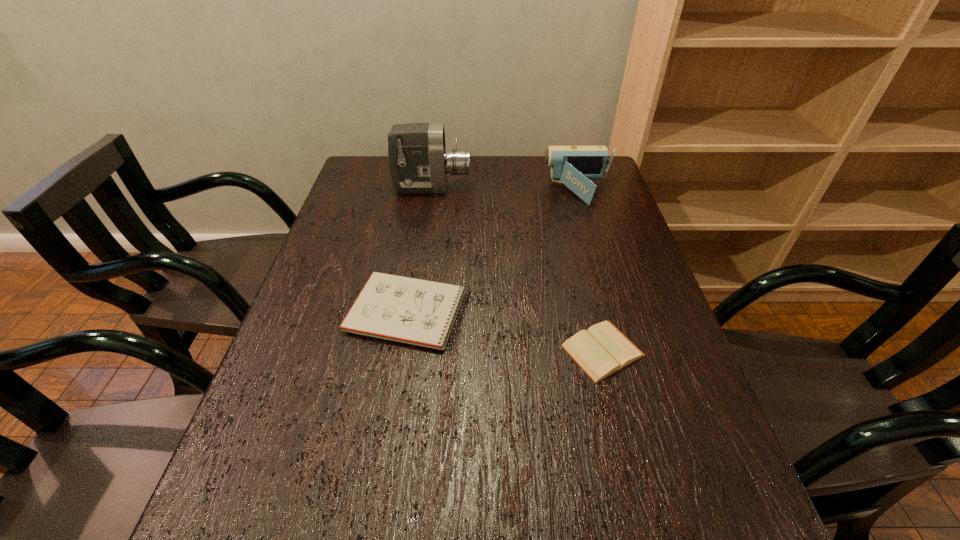
Locate an element on the screen. The image size is (960, 540). free region located on the right of the notepad is located at coordinates (524, 312).

Where is `free region located 0.390m on the back of the diary`? This screenshot has height=540, width=960. free region located 0.390m on the back of the diary is located at coordinates (569, 219).

Identify the location of camcorder located at the left edge. (418, 161).

This screenshot has height=540, width=960. I want to click on notepad at the left edge, so click(x=415, y=311).

I want to click on camcorder positioned at the right edge, so click(573, 166).

Locate an element on the screen. This screenshot has width=960, height=540. diary located in the right edge section of the desktop is located at coordinates (600, 351).

Image resolution: width=960 pixels, height=540 pixels. In order to click on object that is at the far left corner in this screenshot , I will do `click(418, 161)`.

The height and width of the screenshot is (540, 960). I want to click on object that is at the far right corner, so click(x=573, y=166).

Where is `vacant area at the far edge`? vacant area at the far edge is located at coordinates (494, 183).

You are a GUI agent. You are given a task and a screenshot of the screen. Output one action in this format:
    pyautogui.click(x=<x>, y=<y>)
    Task: Click on the vacant area at the left edge
    
    Given the screenshot: What is the action you would take?
    pyautogui.click(x=329, y=314)